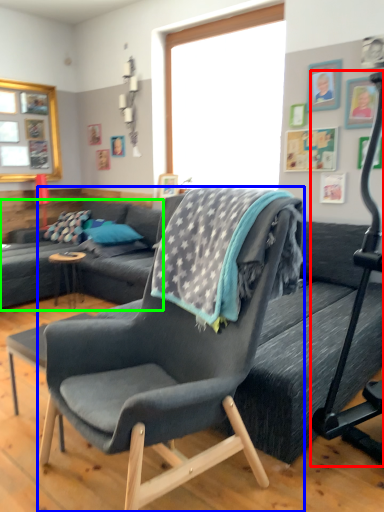
Question: Considering the real-world distances, which object is farthest from baby carriage (highlighted by a red box)? chair (highlighted by a blue box) or studio couch (highlighted by a green box)?

Choices:
 (A) chair
 (B) studio couch

Answer: (B)